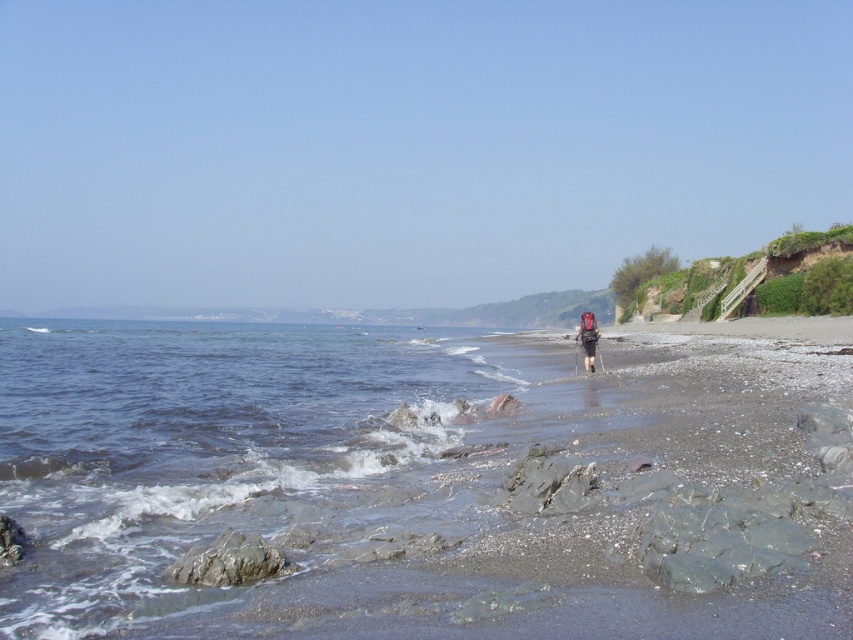
You are a photographer planning to take a landscape photo of the clear water at lower left and the matte black backpack at center. Since you want both objects to be clearly visible in the photo, which object should you focus on to ensure it is in sharp focus, considering their sizes?

The clear water at lower left has a larger size compared to the matte black backpack at center. To ensure both are in sharp focus, focus on the matte black backpack at center since it is smaller and closer to the camera, allowing the larger clear water at lower left to remain within the depth of field.

You are standing on the rocky shoreline and want to take a photo of both point (291, 474) and point (596, 330). Which point will appear larger in your photo?

Point (291, 474) will appear larger in the photo because it is closer to the camera than point (596, 330).